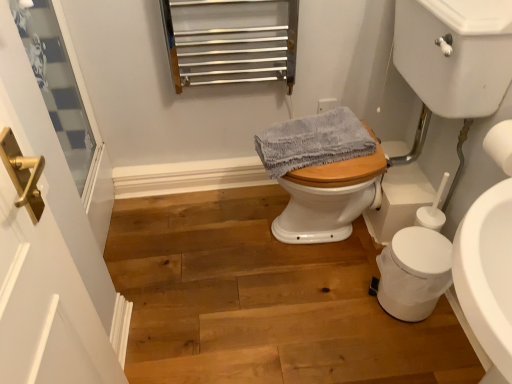
Where is `vacant area in front of white glossy sink at center right`? vacant area in front of white glossy sink at center right is located at coordinates (332, 327).